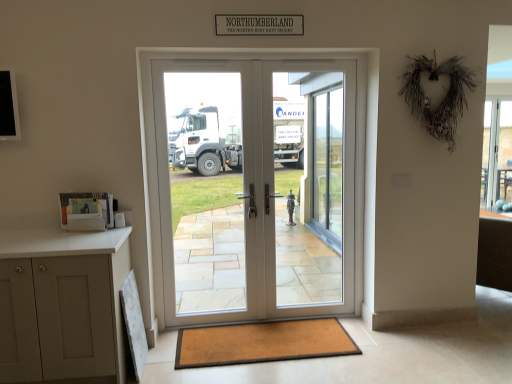
Question: Is white glossy door at center, which is the first screen door in left-to-right order, next to brown textured mat at lower center?

Choices:
 (A) yes
 (B) no

Answer: (B)

Question: Is brown textured mat at lower center at the back of white glossy door at center, which is the first screen door in left-to-right order?

Choices:
 (A) no
 (B) yes

Answer: (A)

Question: Considering the relative sizes of white glossy door at center, which is the first screen door in left-to-right order, and brown textured mat at lower center in the image provided, is white glossy door at center, which is the first screen door in left-to-right order, taller than brown textured mat at lower center?

Choices:
 (A) yes
 (B) no

Answer: (A)

Question: Is there a large distance between white glossy door at center, the second screen door positioned from the right, and brown textured mat at lower center?

Choices:
 (A) no
 (B) yes

Answer: (B)

Question: Is white glossy door at center, which is the first screen door in left-to-right order, aimed at brown textured mat at lower center?

Choices:
 (A) yes
 (B) no

Answer: (A)

Question: Is white glossy screen door at center, positioned as the 1th screen door in right-to-left order, situated inside brown textured mat at lower center or outside?

Choices:
 (A) inside
 (B) outside

Answer: (B)

Question: From a real-world perspective, relative to brown textured mat at lower center, is white glossy screen door at center, acting as the second screen door starting from the left, vertically above or below?

Choices:
 (A) below
 (B) above

Answer: (B)

Question: Relative to brown textured mat at lower center, is white glossy screen door at center, positioned as the 1th screen door in right-to-left order, in front or behind?

Choices:
 (A) behind
 (B) front

Answer: (A)

Question: Based on their sizes in the image, would you say white glossy screen door at center, acting as the second screen door starting from the left, is bigger or smaller than brown textured mat at lower center?

Choices:
 (A) small
 (B) big

Answer: (B)

Question: In terms of height, does white glossy screen door at center, acting as the second screen door starting from the left, look taller or shorter compared to white glossy door at center, which is the first screen door in left-to-right order?

Choices:
 (A) tall
 (B) short

Answer: (A)

Question: Is point (349, 273) closer or farther from the camera than point (232, 188)?

Choices:
 (A) farther
 (B) closer

Answer: (B)

Question: From a real-world perspective, is white glossy screen door at center, acting as the second screen door starting from the left, above or below white glossy door at center, the second screen door positioned from the right?

Choices:
 (A) above
 (B) below

Answer: (A)

Question: From the image's perspective, is white glossy screen door at center, acting as the second screen door starting from the left, above or below white glossy door at center, which is the first screen door in left-to-right order?

Choices:
 (A) below
 (B) above

Answer: (B)

Question: From the image's perspective, is clear glass window at right positioned above or below white glossy screen door at center, positioned as the 1th screen door in right-to-left order?

Choices:
 (A) above
 (B) below

Answer: (A)

Question: Choose the correct answer: Is clear glass window at right inside white glossy screen door at center, acting as the second screen door starting from the left, or outside it?

Choices:
 (A) inside
 (B) outside

Answer: (B)